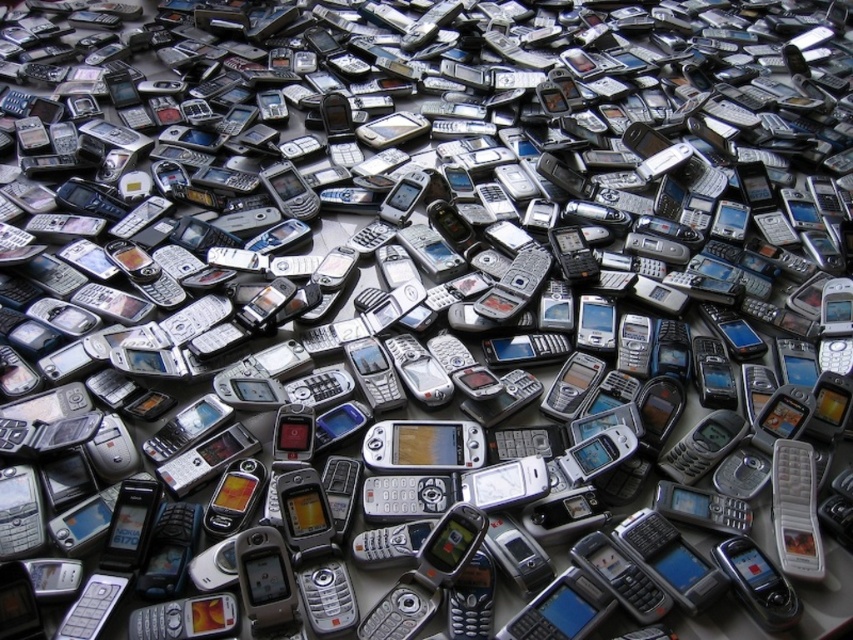
Question: Is wooden phone at center further to the viewer compared to silver metallic phone at center?

Choices:
 (A) yes
 (B) no

Answer: (A)

Question: Can you confirm if wooden phone at center is wider than silver metallic phone at center?

Choices:
 (A) no
 (B) yes

Answer: (B)

Question: Does wooden phone at center come in front of silver metallic phone at center?

Choices:
 (A) no
 (B) yes

Answer: (A)

Question: Which point is farther from the camera taking this photo?

Choices:
 (A) (792, 602)
 (B) (424, 432)

Answer: (B)